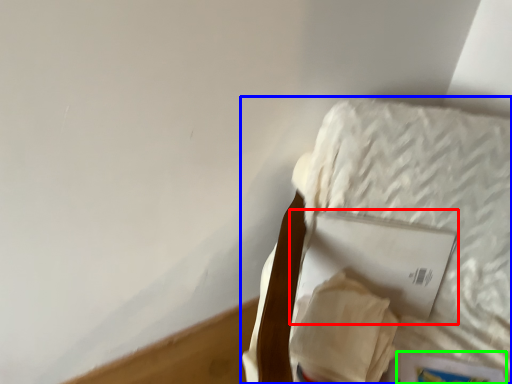
Question: Which object is the farthest from paperback book (highlighted by a red box)? Choose among these: furniture (highlighted by a blue box) or paperback book (highlighted by a green box).

Choices:
 (A) furniture
 (B) paperback book

Answer: (B)